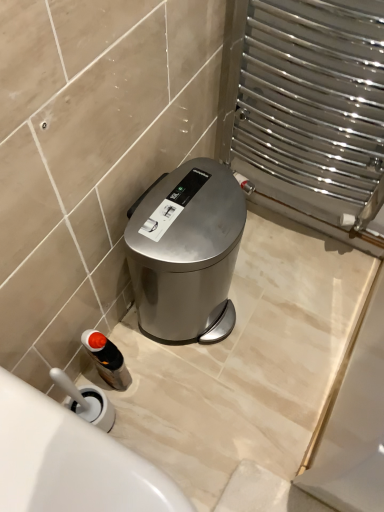
Question: Are white glossy bath at lower left and satin silver trash can at center far apart?

Choices:
 (A) no
 (B) yes

Answer: (A)

Question: Does white glossy bath at lower left appear on the left side of satin silver trash can at center?

Choices:
 (A) yes
 (B) no

Answer: (A)

Question: Considering the relative sizes of white glossy bath at lower left and satin silver trash can at center in the image provided, is white glossy bath at lower left taller than satin silver trash can at center?

Choices:
 (A) yes
 (B) no

Answer: (B)

Question: Is white glossy bath at lower left closer to camera compared to satin silver trash can at center?

Choices:
 (A) yes
 (B) no

Answer: (A)

Question: Is white glossy bath at lower left aimed at satin silver trash can at center?

Choices:
 (A) yes
 (B) no

Answer: (B)

Question: Visually, is satin silver trash can at center positioned to the left or to the right of white glossy bath at lower left?

Choices:
 (A) left
 (B) right

Answer: (B)

Question: In the image, is satin silver trash can at center positioned in front of or behind white glossy bath at lower left?

Choices:
 (A) behind
 (B) front

Answer: (A)

Question: Considering the positions of satin silver trash can at center and white glossy bath at lower left in the image, is satin silver trash can at center taller or shorter than white glossy bath at lower left?

Choices:
 (A) short
 (B) tall

Answer: (B)

Question: Is satin silver trash can at center situated inside white glossy bath at lower left or outside?

Choices:
 (A) inside
 (B) outside

Answer: (B)

Question: Looking at the image, does white glossy bath at lower left seem bigger or smaller compared to satin silver trash can at center?

Choices:
 (A) big
 (B) small

Answer: (B)

Question: Is white glossy bath at lower left to the left or to the right of satin silver trash can at center in the image?

Choices:
 (A) left
 (B) right

Answer: (A)

Question: Relative to satin silver trash can at center, is white glossy bath at lower left in front or behind?

Choices:
 (A) behind
 (B) front

Answer: (B)

Question: Is point (182, 495) positioned closer to the camera than point (140, 228)?

Choices:
 (A) farther
 (B) closer

Answer: (A)

Question: Relative to translucent plastic bottle at lower left, is white glossy bath at lower left in front or behind?

Choices:
 (A) behind
 (B) front

Answer: (B)

Question: Is white glossy bath at lower left taller or shorter than translucent plastic bottle at lower left?

Choices:
 (A) short
 (B) tall

Answer: (B)